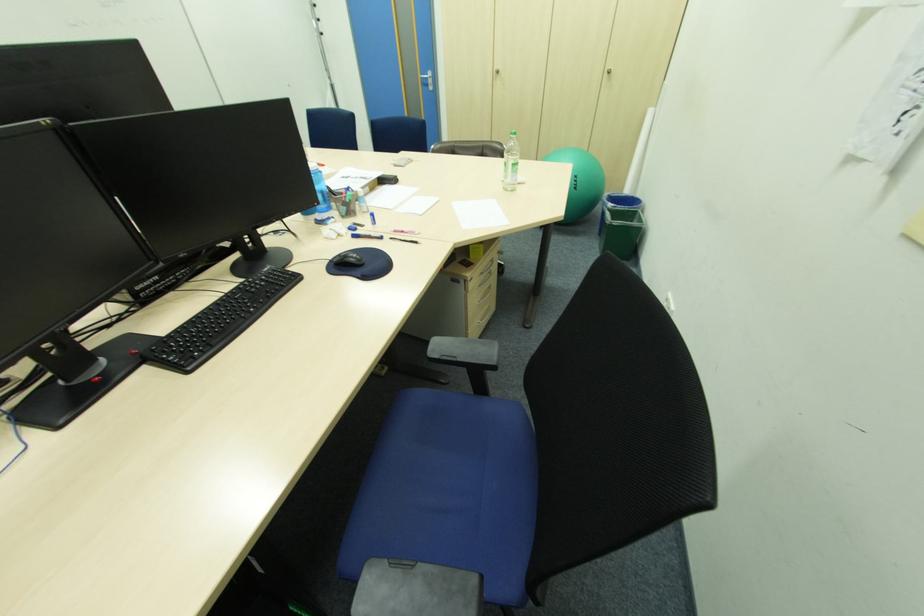
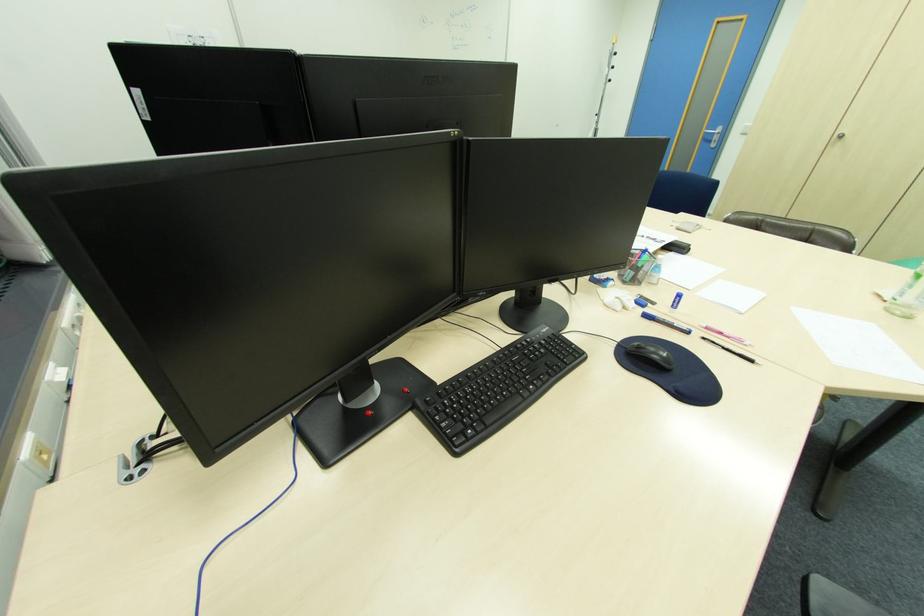
Question: The first image is from the beginning of the video and the second image is from the end. How did the camera likely rotate when shooting the video?

Choices:
 (A) Left
 (B) Right
 (C) Up
 (D) Down

Answer: (A)